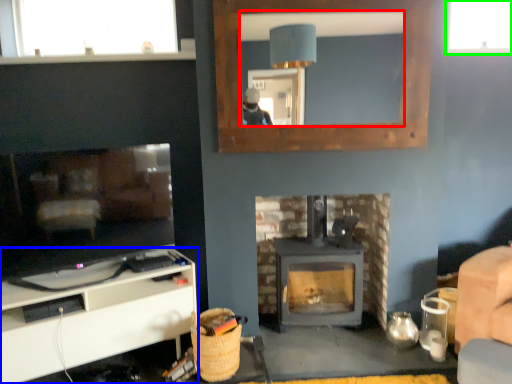
Question: Based on their relative distances, which object is farther from mirror (highlighted by a red box)? Choose from cabinetry (highlighted by a blue box) and window (highlighted by a green box).

Choices:
 (A) cabinetry
 (B) window

Answer: (A)